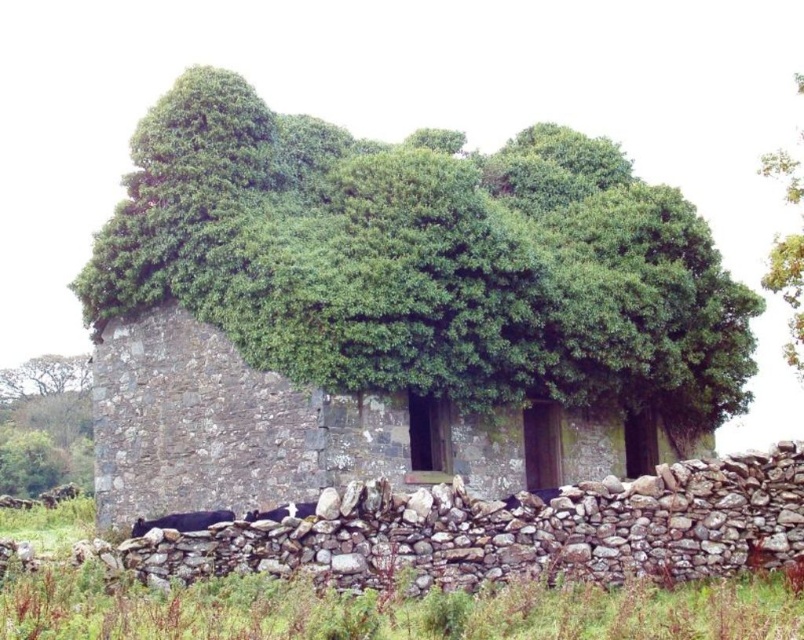
Question: Which point is farther to the camera?

Choices:
 (A) (80, 460)
 (B) (536, 132)

Answer: (A)

Question: Is green leafy tree at center thinner than green leafy tree at upper left?

Choices:
 (A) no
 (B) yes

Answer: (A)

Question: Which of the following is the closest to the observer?

Choices:
 (A) (78, 392)
 (B) (776, 168)

Answer: (A)

Question: Which point appears closest to the camera in this image?

Choices:
 (A) (224, 154)
 (B) (792, 168)
 (C) (3, 392)

Answer: (A)

Question: Does green leafy tree at center have a lesser width compared to green leafy tree at upper left?

Choices:
 (A) no
 (B) yes

Answer: (A)

Question: Does green leafy tree at upper left appear over green leafy tree at upper right?

Choices:
 (A) no
 (B) yes

Answer: (A)